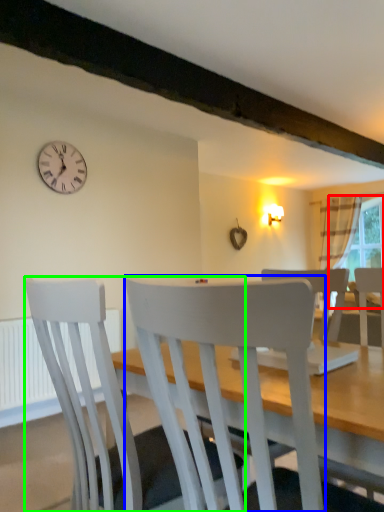
Question: Estimate the real-world distances between objects in this image. Which object is closer to window screen (highlighted by a red box), chair (highlighted by a blue box) or chair (highlighted by a green box)?

Choices:
 (A) chair
 (B) chair

Answer: (B)